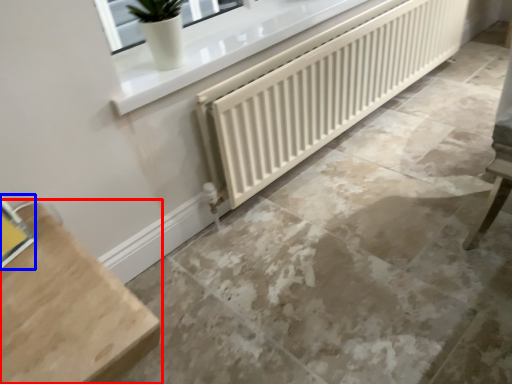
Question: Which of the following is the closest to the observer, furniture (highlighted by a red box) or window (highlighted by a blue box)?

Choices:
 (A) furniture
 (B) window

Answer: (A)